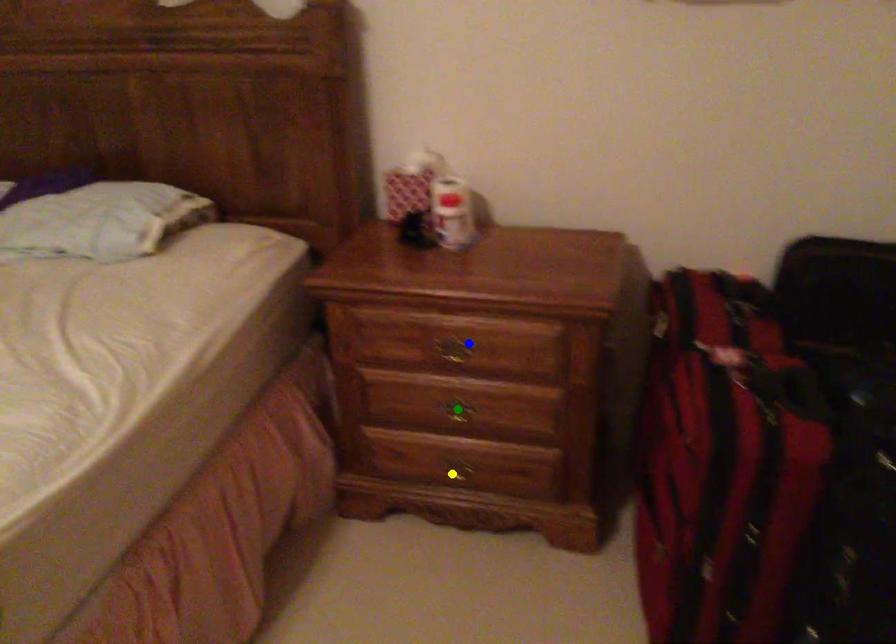
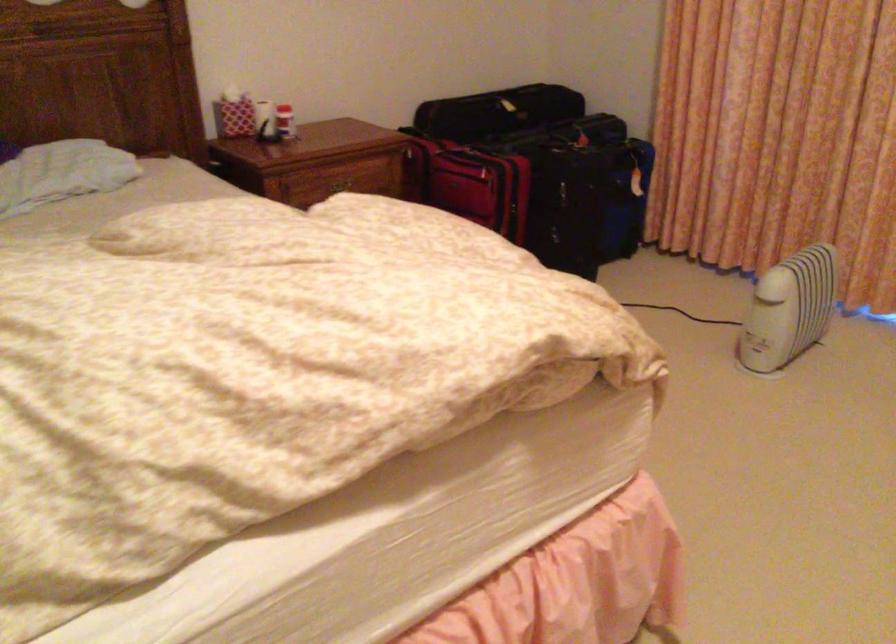
I am providing you with two images of the same scene from different viewpoints. Three points are marked in image1. Which point corresponds to a part or object that is occluded in image2?In image1, three points are marked. Which of them correspond to a part or object that is occluded in image2?Among the three points shown in image1, which one corresponds to a part or object that is no longer visible due to occlusion in image2?

yellow point, green point cannot be seen in image2.